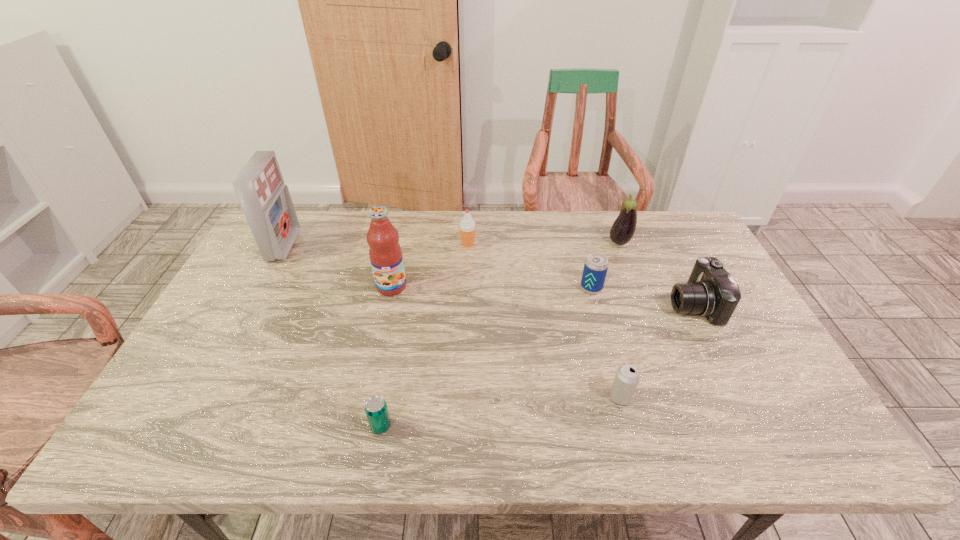
In the image, there is a desktop. Identify the location of blank space at the right edge. The height and width of the screenshot is (540, 960). (757, 332).

This screenshot has height=540, width=960. In order to click on blank space at the far left corner of the desktop in this screenshot , I will do `click(314, 224)`.

The width and height of the screenshot is (960, 540). What are the coordinates of `free space at the far right corner of the desktop` in the screenshot? It's located at (654, 213).

Image resolution: width=960 pixels, height=540 pixels. What are the coordinates of `vacant space at the near right corner of the desktop` in the screenshot? It's located at 789,440.

Locate an element on the screen. This screenshot has width=960, height=540. vacant space that is in between the second farthest beer can and the rightmost object is located at coordinates (657, 350).

At what (x,y) coordinates should I click in order to perform the action: click on free spot between the nearest beer can and the third tallest object. Please return your answer as a coordinate pair (x, y). The height and width of the screenshot is (540, 960). Looking at the image, I should click on (500, 334).

Locate an element on the screen. The image size is (960, 540). vacant space that's between the second nearest object and the icecream is located at coordinates (544, 321).

Find the location of a particular element. This screenshot has height=540, width=960. vacant point located between the fourth object from left to right and the fruit juice is located at coordinates (430, 265).

This screenshot has height=540, width=960. I want to click on blank region between the camera and the second object from right to left, so click(x=657, y=273).

Find the location of a particular element. Image resolution: width=960 pixels, height=540 pixels. vacant point located between the farthest beer can and the nearest object is located at coordinates (486, 357).